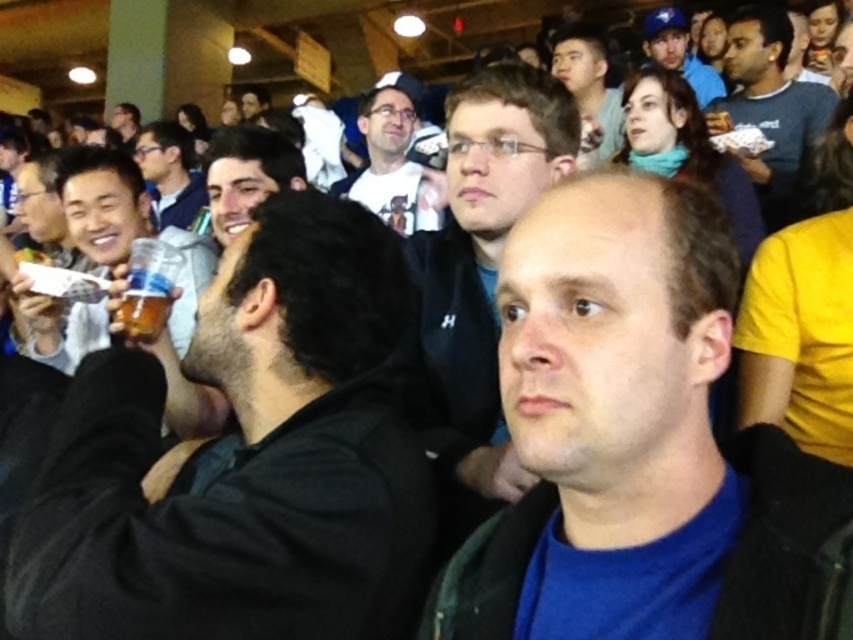
Question: Which object is closer to the camera taking this photo?

Choices:
 (A) matte black hair at center
 (B) black matte cup at left

Answer: (B)

Question: Which object appears closest to the camera in this image?

Choices:
 (A) blue matte jacket at center
 (B) black matte cup at left

Answer: (A)

Question: Is blue matte jacket at center to the right of matte black jacket at upper center from the viewer's perspective?

Choices:
 (A) no
 (B) yes

Answer: (B)

Question: Is matte black jacket at center bigger than matte black hair at center?

Choices:
 (A) yes
 (B) no

Answer: (A)

Question: Which of the following is the closest to the observer?

Choices:
 (A) black matte cup at left
 (B) translucent plastic cup at center left
 (C) clear plastic cup at left
 (D) white t-shirt at center

Answer: (A)

Question: Where is clear plastic cup at left located in relation to white t-shirt at center in the image?

Choices:
 (A) right
 (B) left

Answer: (B)